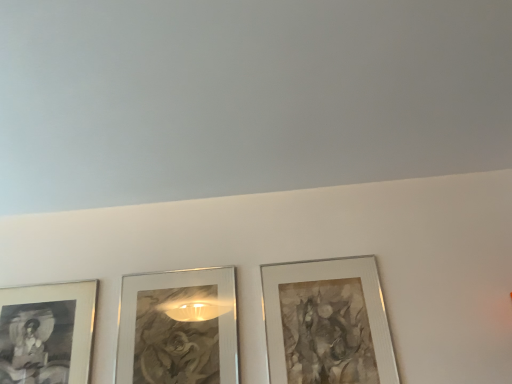
What is the approximate width of metallic silver picture frame at center, which is the second picture frame in right-to-left order?

metallic silver picture frame at center, which is the second picture frame in right-to-left order, is 1.17 inches in width.

Locate an element on the screen. The width and height of the screenshot is (512, 384). silver metallic picture frame at center right, the third picture frame in the left-to-right sequence is located at coordinates (327, 322).

Is point (204, 280) more distant than point (314, 274)?

Yes, it is behind point (314, 274).

Could you measure the distance between metallic silver picture frame at center, marked as the second picture frame in a left-to-right arrangement, and silver metallic picture frame at center right, placed as the 1th picture frame when sorted from right to left?

A distance of 29.92 centimeters exists between metallic silver picture frame at center, marked as the second picture frame in a left-to-right arrangement, and silver metallic picture frame at center right, placed as the 1th picture frame when sorted from right to left.

Consider the image. Is metallic silver picture frame at center, which is the second picture frame in right-to-left order, not close to silver metallic picture frame at center right, placed as the 1th picture frame when sorted from right to left?

They are positioned close to each other.

Is metallic silver picture frame at center, marked as the second picture frame in a left-to-right arrangement, at the right side of silver metallic picture frame at center right, the third picture frame in the left-to-right sequence?

No, metallic silver picture frame at center, marked as the second picture frame in a left-to-right arrangement, is not to the right of silver metallic picture frame at center right, the third picture frame in the left-to-right sequence.

Between point (377, 381) and point (44, 316), which one is positioned behind?

Point (44, 316)

Considering the positions of objects silver metallic picture frame at center right, placed as the 1th picture frame when sorted from right to left, and matte black picture frame at lower left, the 3th picture frame from the right, in the image provided, who is in front, silver metallic picture frame at center right, placed as the 1th picture frame when sorted from right to left, or matte black picture frame at lower left, the 3th picture frame from the right,?

Positioned in front is silver metallic picture frame at center right, placed as the 1th picture frame when sorted from right to left.

Is silver metallic picture frame at center right, the third picture frame in the left-to-right sequence, in contact with matte black picture frame at lower left, placed as the 1th picture frame when sorted from left to right?

No.

Between silver metallic picture frame at center right, placed as the 1th picture frame when sorted from right to left, and matte black picture frame at lower left, the 3th picture frame from the right, which one has larger width?

silver metallic picture frame at center right, placed as the 1th picture frame when sorted from right to left, is wider.

From the image's perspective, is silver metallic picture frame at center right, placed as the 1th picture frame when sorted from right to left, positioned above or below metallic silver picture frame at center, marked as the second picture frame in a left-to-right arrangement?

From the image's perspective, silver metallic picture frame at center right, placed as the 1th picture frame when sorted from right to left, appears above metallic silver picture frame at center, marked as the second picture frame in a left-to-right arrangement.

Can you confirm if silver metallic picture frame at center right, placed as the 1th picture frame when sorted from right to left, is bigger than metallic silver picture frame at center, marked as the second picture frame in a left-to-right arrangement?

Indeed, silver metallic picture frame at center right, placed as the 1th picture frame when sorted from right to left, has a larger size compared to metallic silver picture frame at center, marked as the second picture frame in a left-to-right arrangement.

From the image's perspective, which one is positioned higher, matte black picture frame at lower left, the 3th picture frame from the right, or silver metallic picture frame at center right, placed as the 1th picture frame when sorted from right to left?

From the image's view, silver metallic picture frame at center right, placed as the 1th picture frame when sorted from right to left, is above.

In terms of height, does matte black picture frame at lower left, the 3th picture frame from the right, look taller or shorter compared to silver metallic picture frame at center right, placed as the 1th picture frame when sorted from right to left?

Considering their sizes, matte black picture frame at lower left, the 3th picture frame from the right, has less height than silver metallic picture frame at center right, placed as the 1th picture frame when sorted from right to left.

What's the angular difference between matte black picture frame at lower left, the 3th picture frame from the right, and silver metallic picture frame at center right, placed as the 1th picture frame when sorted from right to left,'s facing directions?

They differ by 0.00078 degrees in their facing directions.

Does metallic silver picture frame at center, marked as the second picture frame in a left-to-right arrangement, turn towards matte black picture frame at lower left, the 3th picture frame from the right?

No, metallic silver picture frame at center, marked as the second picture frame in a left-to-right arrangement, is not oriented towards matte black picture frame at lower left, the 3th picture frame from the right.

In the scene shown: From a real-world perspective, which object stands above the other?

From a 3D spatial view, matte black picture frame at lower left, the 3th picture frame from the right, is above.

Which is more to the left, metallic silver picture frame at center, which is the second picture frame in right-to-left order, or matte black picture frame at lower left, the 3th picture frame from the right?

matte black picture frame at lower left, the 3th picture frame from the right, is more to the left.

Can we say metallic silver picture frame at center, marked as the second picture frame in a left-to-right arrangement, lies outside matte black picture frame at lower left, the 3th picture frame from the right?

metallic silver picture frame at center, marked as the second picture frame in a left-to-right arrangement, lies outside matte black picture frame at lower left, the 3th picture frame from the right,'s area.

From the image's perspective, is matte black picture frame at lower left, placed as the 1th picture frame when sorted from left to right, beneath metallic silver picture frame at center, marked as the second picture frame in a left-to-right arrangement?

Correct, matte black picture frame at lower left, placed as the 1th picture frame when sorted from left to right, appears lower than metallic silver picture frame at center, marked as the second picture frame in a left-to-right arrangement, in the image.

What's the angular difference between matte black picture frame at lower left, placed as the 1th picture frame when sorted from left to right, and metallic silver picture frame at center, which is the second picture frame in right-to-left order,'s facing directions?

matte black picture frame at lower left, placed as the 1th picture frame when sorted from left to right, and metallic silver picture frame at center, which is the second picture frame in right-to-left order, are facing 0.000249 degrees away from each other.

Is matte black picture frame at lower left, placed as the 1th picture frame when sorted from left to right, shorter than metallic silver picture frame at center, which is the second picture frame in right-to-left order?

Yes.

Based on their sizes in the image, would you say matte black picture frame at lower left, placed as the 1th picture frame when sorted from left to right, is bigger or smaller than metallic silver picture frame at center, which is the second picture frame in right-to-left order?

In the image, matte black picture frame at lower left, placed as the 1th picture frame when sorted from left to right, appears to be smaller than metallic silver picture frame at center, which is the second picture frame in right-to-left order.

The width and height of the screenshot is (512, 384). What are the coordinates of `picture frame in front of the metallic silver picture frame at center, which is the second picture frame in right-to-left order` in the screenshot? It's located at (327, 322).

Which picture frame is the 2nd one when counting from the right side of the matte black picture frame at lower left, placed as the 1th picture frame when sorted from left to right? Please provide its 2D coordinates.

[(327, 322)]

Which object lies nearer to the anchor point silver metallic picture frame at center right, placed as the 1th picture frame when sorted from right to left, matte black picture frame at lower left, the 3th picture frame from the right, or metallic silver picture frame at center, which is the second picture frame in right-to-left order?

Based on the image, metallic silver picture frame at center, which is the second picture frame in right-to-left order, appears to be nearer to silver metallic picture frame at center right, placed as the 1th picture frame when sorted from right to left.

Looking at the image, which one is located closer to matte black picture frame at lower left, the 3th picture frame from the right, silver metallic picture frame at center right, the third picture frame in the left-to-right sequence, or metallic silver picture frame at center, marked as the second picture frame in a left-to-right arrangement?

The object closer to matte black picture frame at lower left, the 3th picture frame from the right, is metallic silver picture frame at center, marked as the second picture frame in a left-to-right arrangement.

Considering their positions, is metallic silver picture frame at center, marked as the second picture frame in a left-to-right arrangement, positioned further to matte black picture frame at lower left, the 3th picture frame from the right, than silver metallic picture frame at center right, placed as the 1th picture frame when sorted from right to left?

silver metallic picture frame at center right, placed as the 1th picture frame when sorted from right to left, is positioned further to the anchor matte black picture frame at lower left, the 3th picture frame from the right.

Estimate the real-world distances between objects in this image. Which object is closer to metallic silver picture frame at center, marked as the second picture frame in a left-to-right arrangement, matte black picture frame at lower left, placed as the 1th picture frame when sorted from left to right, or silver metallic picture frame at center right, the third picture frame in the left-to-right sequence?

matte black picture frame at lower left, placed as the 1th picture frame when sorted from left to right.

Looking at this image, based on their spatial positions, is silver metallic picture frame at center right, the third picture frame in the left-to-right sequence, or matte black picture frame at lower left, the 3th picture frame from the right, further from metallic silver picture frame at center, marked as the second picture frame in a left-to-right arrangement?

The object further to metallic silver picture frame at center, marked as the second picture frame in a left-to-right arrangement, is silver metallic picture frame at center right, the third picture frame in the left-to-right sequence.

Looking at the image, which one is located closer to silver metallic picture frame at center right, placed as the 1th picture frame when sorted from right to left, metallic silver picture frame at center, marked as the second picture frame in a left-to-right arrangement, or matte black picture frame at lower left, placed as the 1th picture frame when sorted from left to right?

metallic silver picture frame at center, marked as the second picture frame in a left-to-right arrangement, is closer to silver metallic picture frame at center right, placed as the 1th picture frame when sorted from right to left.

Locate an element on the screen. Image resolution: width=512 pixels, height=384 pixels. picture frame between matte black picture frame at lower left, the 3th picture frame from the right, and silver metallic picture frame at center right, placed as the 1th picture frame when sorted from right to left is located at coordinates (178, 327).